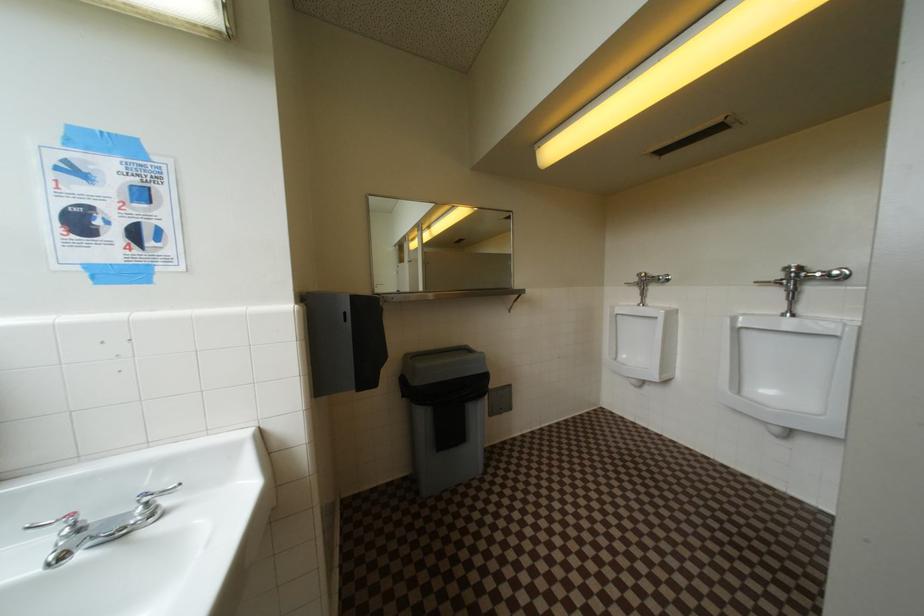
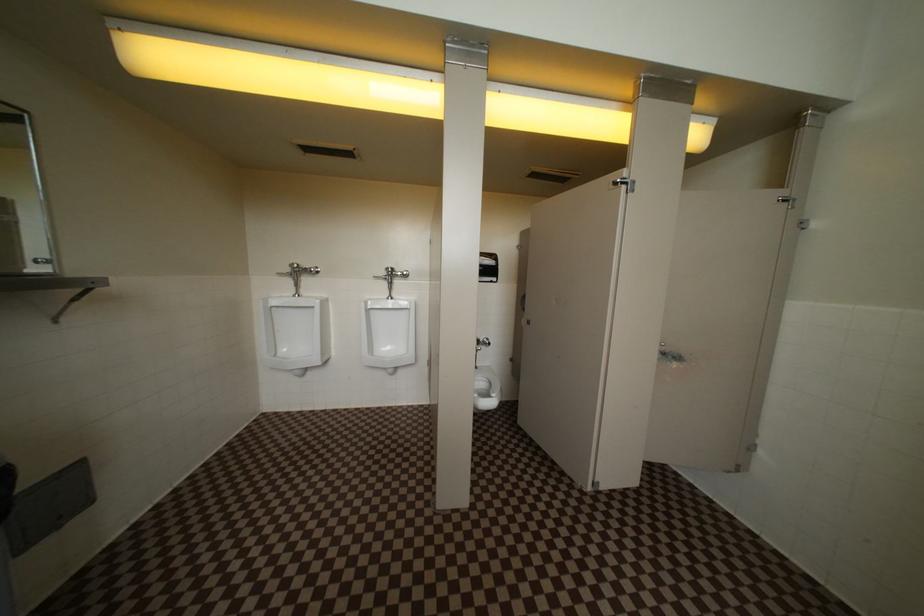
Question: How did the camera likely rotate?

Choices:
 (A) Left
 (B) Right
 (C) Up
 (D) Down

Answer: (B)